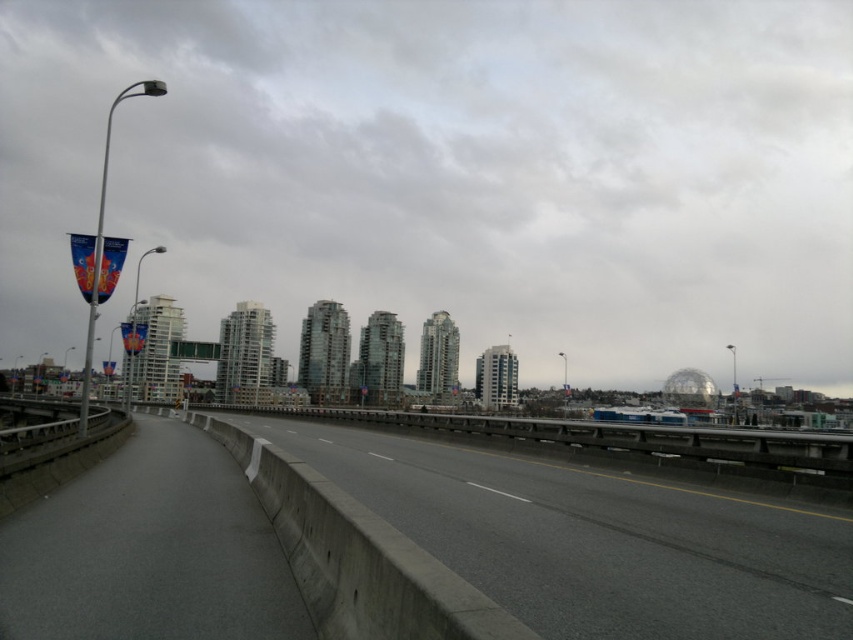
Can you confirm if transparent glass buildings at center is positioned to the right of gray concrete highway at center?

Yes, transparent glass buildings at center is to the right of gray concrete highway at center.

Who is more distant from viewer, [846,24] or [654,522]?

The point [846,24] is more distant.

Is point (77, 99) positioned behind point (595, 589)?

Yes, it is.

Locate an element on the screen. transparent glass buildings at center is located at coordinates (448, 173).